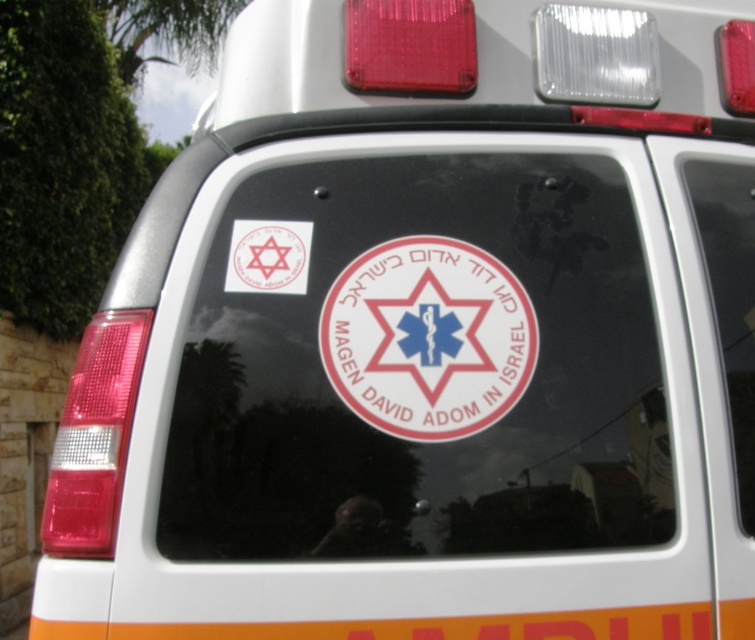
Between white sticker at center and matte white sticker at upper left, which one is positioned higher?

matte white sticker at upper left is above.

Does point (413, 308) come behind point (254, 280)?

Yes, point (413, 308) is behind point (254, 280).

Who is more distant from viewer, (330, 328) or (285, 292)?

The point (285, 292) is more distant.

I want to click on white sticker at center, so click(x=427, y=339).